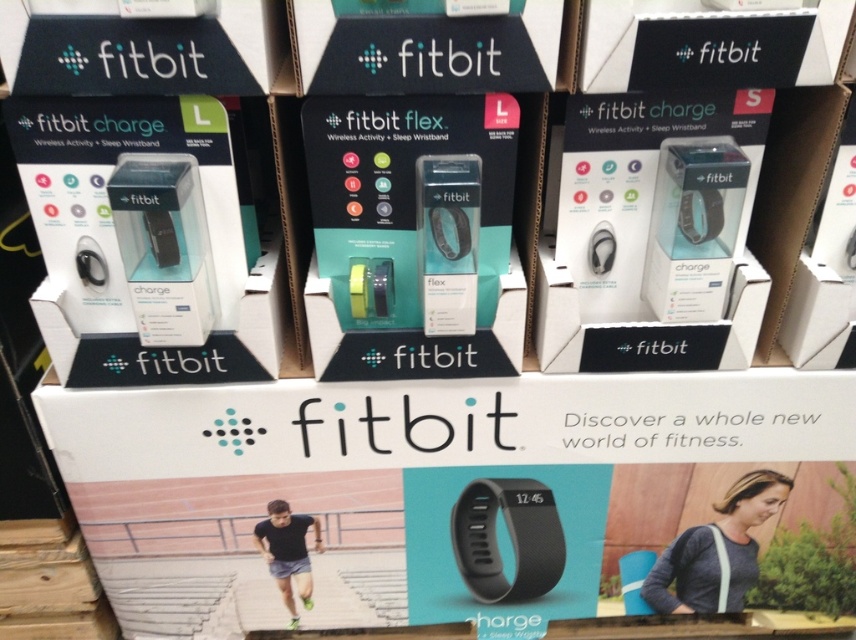
Question: Which object appears closest to the camera in this image?

Choices:
 (A) black matte wristband at center
 (B) gray fabric purse at lower right
 (C) black matte fitbit at center
 (D) white matte box at center

Answer: (C)

Question: Among these objects, which one is nearest to the camera?

Choices:
 (A) black matte fitbit box at center
 (B) black matte fitbit at center
 (C) white matte box at center
 (D) black matte wristband at center

Answer: (A)

Question: Which object is closer to the camera taking this photo?

Choices:
 (A) matte black box at upper left
 (B) white matte box at center
 (C) black matte wristband at center
 (D) black matte fitbit at center

Answer: (A)

Question: Can you confirm if black matte fitbit at center is thinner than gray fabric purse at lower right?

Choices:
 (A) no
 (B) yes

Answer: (A)

Question: Does black matte fitbit at center have a smaller size compared to gray fabric purse at lower right?

Choices:
 (A) no
 (B) yes

Answer: (B)

Question: Observing the image, what is the correct spatial positioning of black matte wristband at center in reference to white matte box at center?

Choices:
 (A) left
 (B) right

Answer: (B)